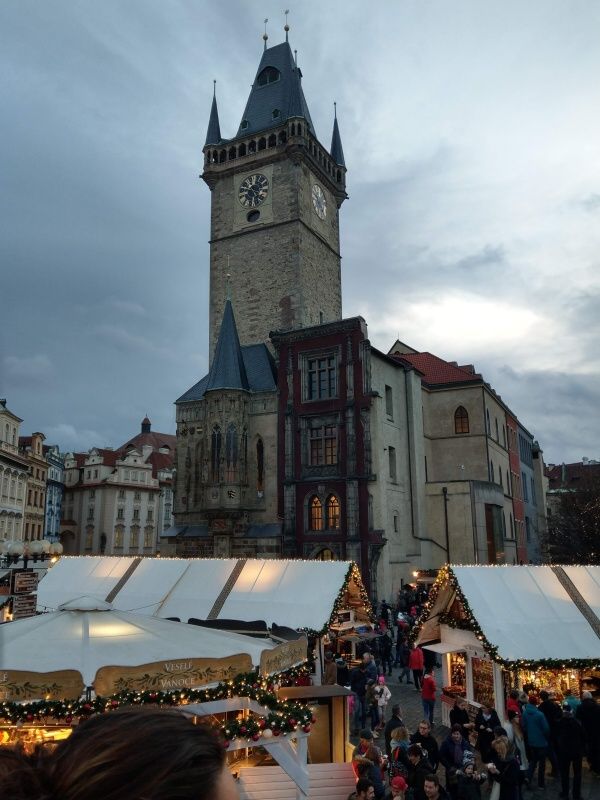
Identify the location of clocks. (253, 193), (323, 208).